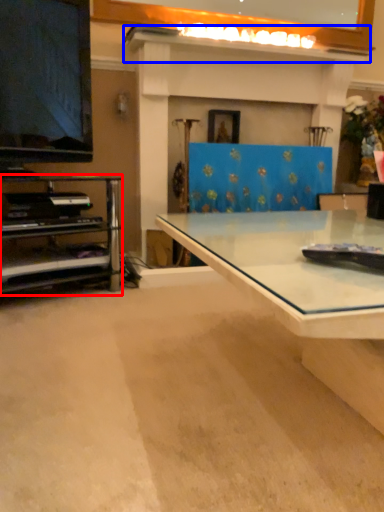
Question: Which object is further to the camera taking this photo, shelf (highlighted by a red box) or mantle (highlighted by a blue box)?

Choices:
 (A) shelf
 (B) mantle

Answer: (B)